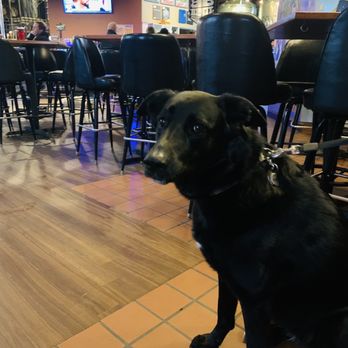
The width and height of the screenshot is (348, 348). In order to click on wall in this screenshot , I will do `click(119, 9)`, `click(144, 10)`.